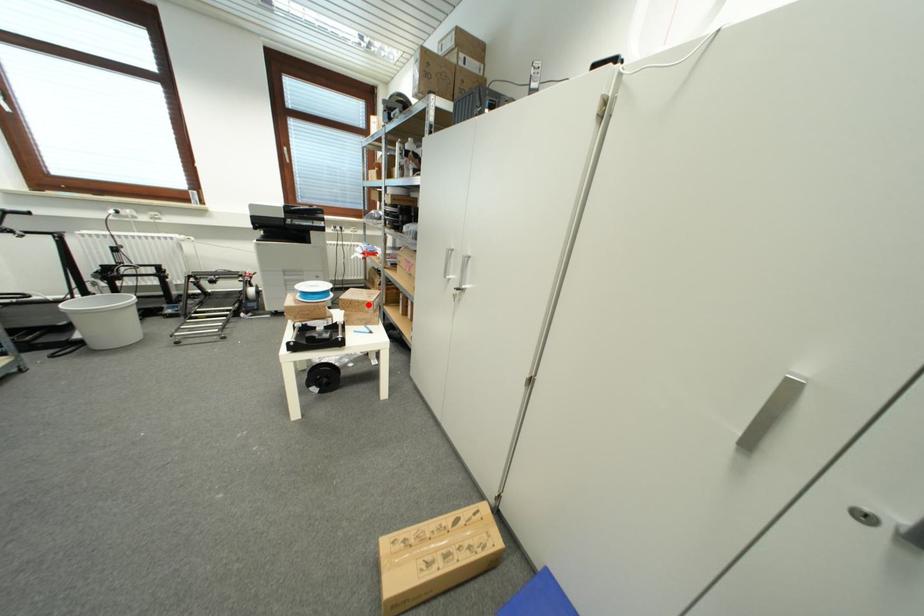
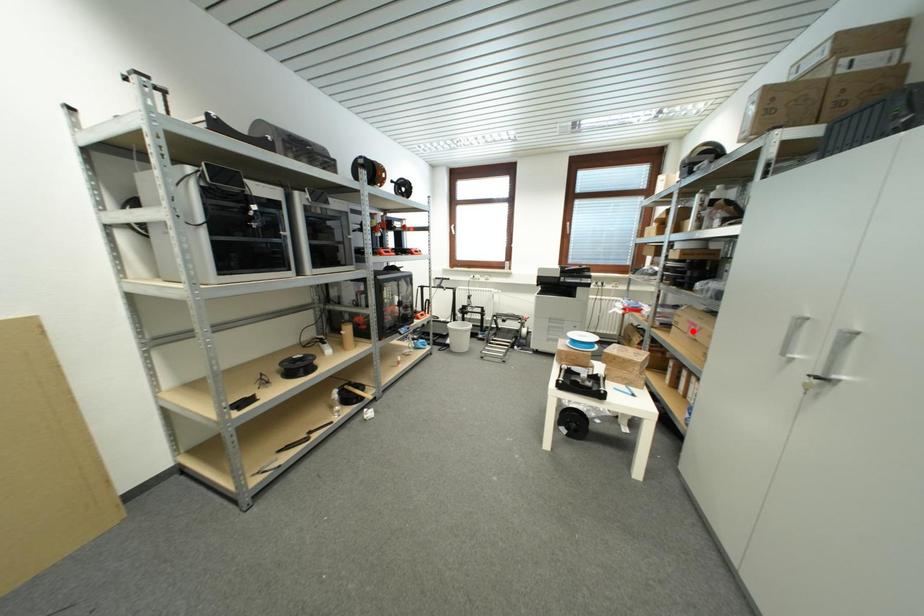
I am providing you with two images of the same scene from different viewpoints. A red point is marked on the first image and another point is marked on the second image. Does the point marked in image1 correspond to the same location as the one in image2?

No